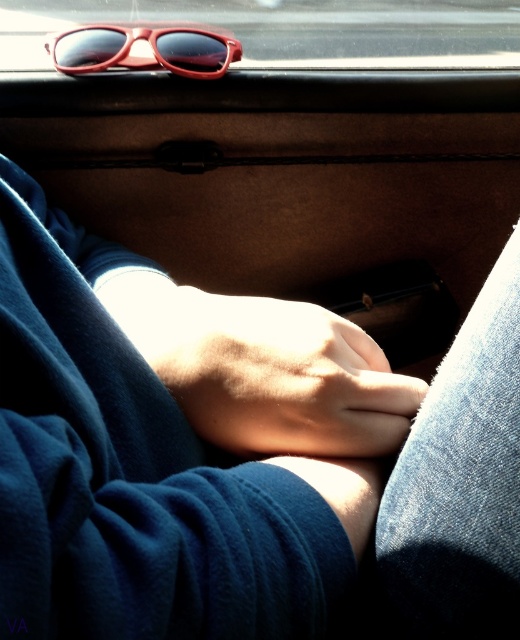
Question: Is smooth skin hand at center bigger than matte plastic sunglasses at upper center?

Choices:
 (A) no
 (B) yes

Answer: (A)

Question: Based on their relative distances, which object is farther from the matte plastic sunglasses at upper center?

Choices:
 (A) smooth skin hand at center
 (B) matte red sunglasses at upper center

Answer: (A)

Question: Considering the real-world distances, which object is farthest from the smooth skin hand at center?

Choices:
 (A) matte plastic sunglasses at upper center
 (B) matte red sunglasses at upper center

Answer: (A)

Question: Is smooth skin hand at center further to camera compared to matte red sunglasses at upper center?

Choices:
 (A) yes
 (B) no

Answer: (B)

Question: Which object appears closest to the camera in this image?

Choices:
 (A) smooth skin hand at center
 (B) matte red sunglasses at upper center
 (C) matte plastic sunglasses at upper center

Answer: (A)

Question: Is matte plastic sunglasses at upper center positioned behind matte red sunglasses at upper center?

Choices:
 (A) no
 (B) yes

Answer: (B)